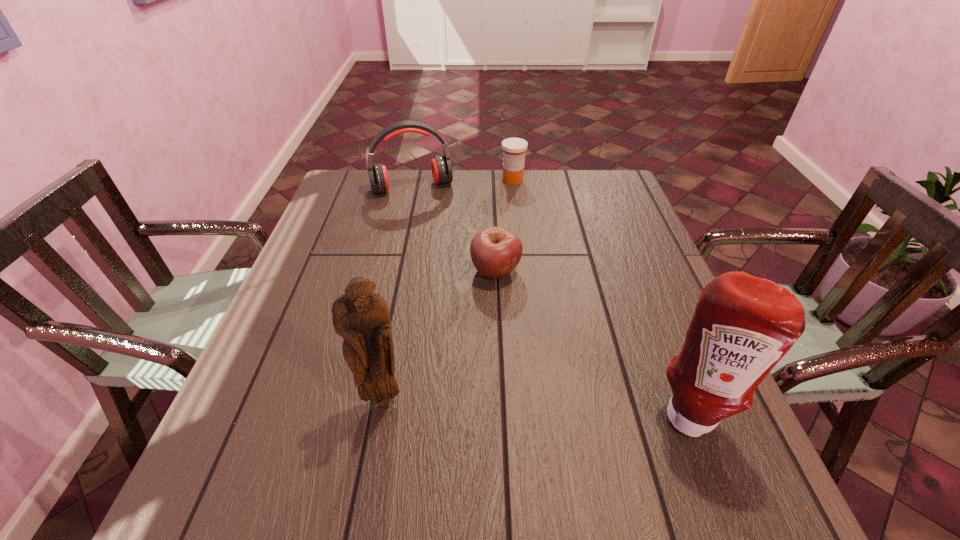
The height and width of the screenshot is (540, 960). In the image, there is a desktop. Find the location of `vacant space at the near right corner`. vacant space at the near right corner is located at coordinates (673, 449).

Find the location of a particular element. This screenshot has height=540, width=960. free space between the third farthest object and the condiment is located at coordinates (592, 342).

The height and width of the screenshot is (540, 960). In order to click on free space between the rightmost object and the medicine in this screenshot , I will do `click(601, 296)`.

The height and width of the screenshot is (540, 960). I want to click on unoccupied area between the earphone and the figurine, so click(x=397, y=294).

At what (x,y) coordinates should I click in order to perform the action: click on free space between the figurine and the third tallest object. Please return your answer as a coordinate pair (x, y). Looking at the image, I should click on (397, 294).

Image resolution: width=960 pixels, height=540 pixels. Identify the location of empty space that is in between the rightmost object and the earphone. (551, 300).

The image size is (960, 540). I want to click on vacant region between the earphone and the third nearest object, so click(x=454, y=229).

At what (x,y) coordinates should I click in order to perform the action: click on vacant point located between the medicine and the third farthest object. Please return your answer as a coordinate pair (x, y). Looking at the image, I should click on (504, 225).

At what (x,y) coordinates should I click in order to perform the action: click on unoccupied area between the medicine and the condiment. Please return your answer as a coordinate pair (x, y). This screenshot has width=960, height=540. Looking at the image, I should click on (601, 296).

Where is `vacant space in between the third shortest object and the medicine`? vacant space in between the third shortest object and the medicine is located at coordinates (463, 184).